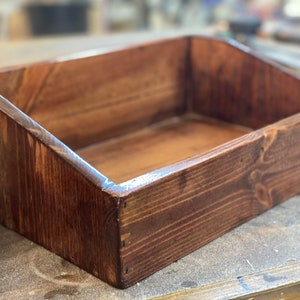
You are a GUI agent. You are given a task and a screenshot of the screen. Output one action in this format:
    pyautogui.click(x=<x>, y=<y>)
    Task: Click on the table in background of image
    This screenshot has height=300, width=300.
    Given the screenshot: What is the action you would take?
    pyautogui.click(x=84, y=38)